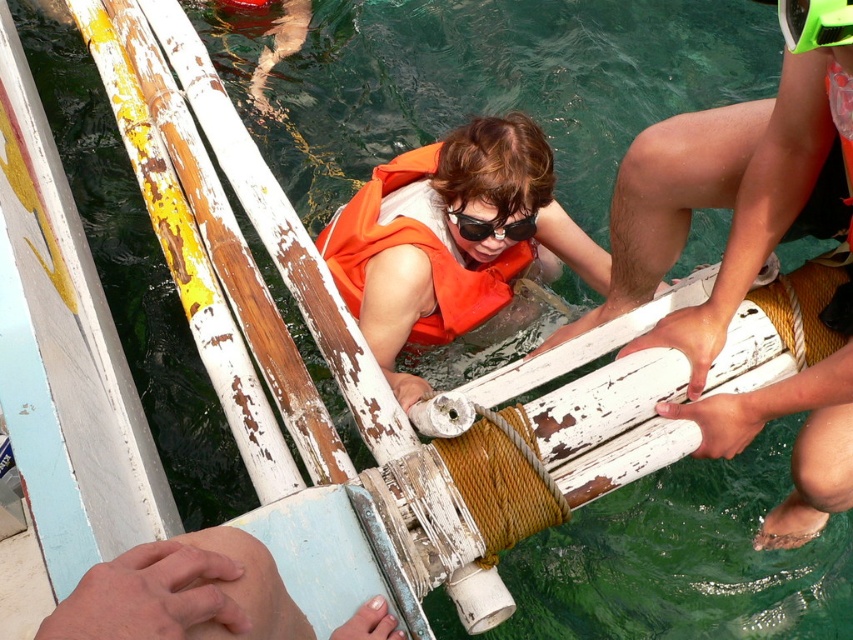
Is smooth skin hand at lower left shorter than orange fabric life jacket at center?

Yes.

This screenshot has width=853, height=640. What do you see at coordinates (183, 593) in the screenshot?
I see `smooth skin hand at lower left` at bounding box center [183, 593].

Identify the location of smooth skin hand at lower left. The height and width of the screenshot is (640, 853). pos(183,593).

Between orange fabric life jacket at center and black plastic goggles at center, which one is positioned lower?

Positioned lower is orange fabric life jacket at center.

Is orange fabric life jacket at center closer to camera compared to black plastic goggles at center?

No, it is not.

Identify the location of orange fabric life jacket at center. (421, 248).

Locate an element on the screen. This screenshot has height=640, width=853. orange fabric life jacket at center is located at coordinates (421, 248).

Looking at this image, does smooth skin hand at lower left have a lesser width compared to black plastic goggles at center?

No.

Which is more to the left, smooth skin hand at lower left or black plastic goggles at center?

From the viewer's perspective, smooth skin hand at lower left appears more on the left side.

Identify the location of smooth skin hand at lower left. This screenshot has height=640, width=853. (183, 593).

This screenshot has width=853, height=640. What are the coordinates of `smooth skin hand at lower left` in the screenshot? It's located at (183, 593).